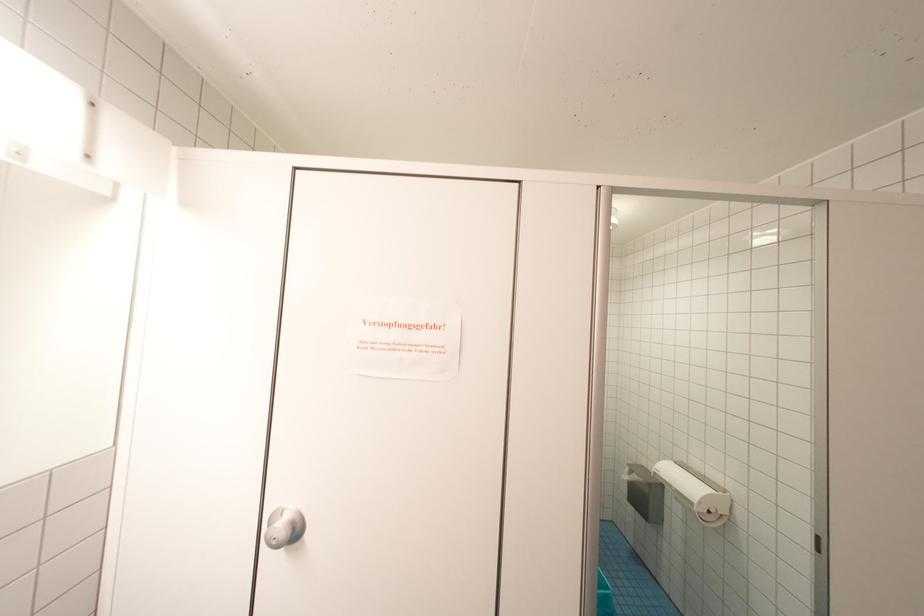
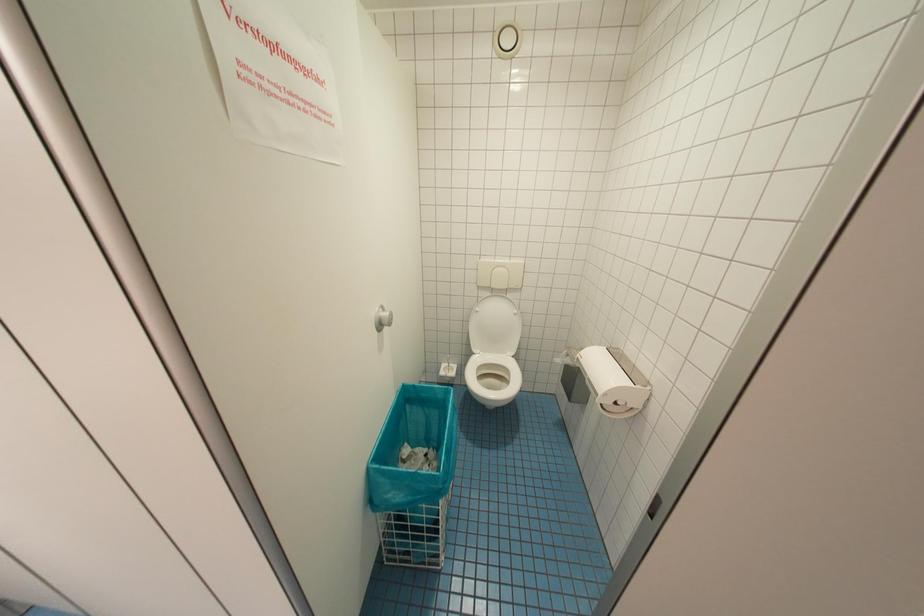
Question: The first image is from the beginning of the video and the second image is from the end. How did the camera likely rotate when shooting the video?

Choices:
 (A) Left
 (B) Right
 (C) Up
 (D) Down

Answer: (D)